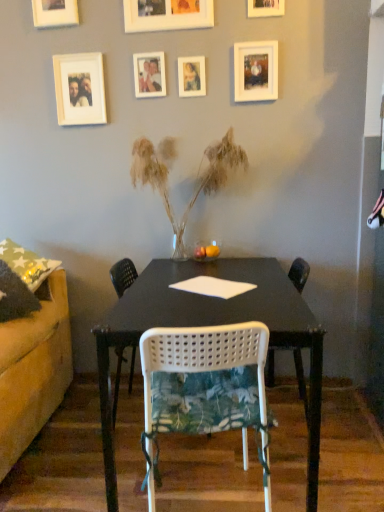
Question: From a real-world perspective, relative to white matte picture frame at upper left, which ranks as the sixth picture frame in right-to-left order, is green floral fabric chair at center, which is the 1th chair from front to back, vertically above or below?

Choices:
 (A) above
 (B) below

Answer: (B)

Question: Is green floral fabric chair at center, which is the 1th chair from front to back, wider or thinner than white matte picture frame at upper left, which ranks as the sixth picture frame in right-to-left order?

Choices:
 (A) wide
 (B) thin

Answer: (A)

Question: Estimate the real-world distances between objects in this image. Which object is farther from the white matte picture frame at upper left, which appears as the seventh picture frame when viewed from the right?

Choices:
 (A) white mesh chair at center, arranged as the 1th chair when viewed from the back
 (B) white matte picture frame at upper center, placed as the 4th picture frame when sorted from left to right
 (C) white matte picture frame at upper center, which ranks as the second picture frame in right-to-left order
 (D) white matte picture frame at upper left, which ranks as the sixth picture frame in right-to-left order
 (E) matte wooden picture frame at upper center, the 3th picture frame when ordered from right to left

Answer: (A)

Question: Which of these objects is positioned closest to the white matte picture frame at upper left, which appears as the seventh picture frame when viewed from the right?

Choices:
 (A) translucent glass vase with dried grass at center
 (B) wooden picture frame at upper center, the seventh picture frame viewed from the left
 (C) white matte picture frame at upper left, which ranks as the sixth picture frame in right-to-left order
 (D) matte white photo frame at upper center, marked as the fifth picture frame in a right-to-left arrangement
 (E) white matte picture frame at upper center, which appears as the sixth picture frame when viewed from the left

Answer: (C)